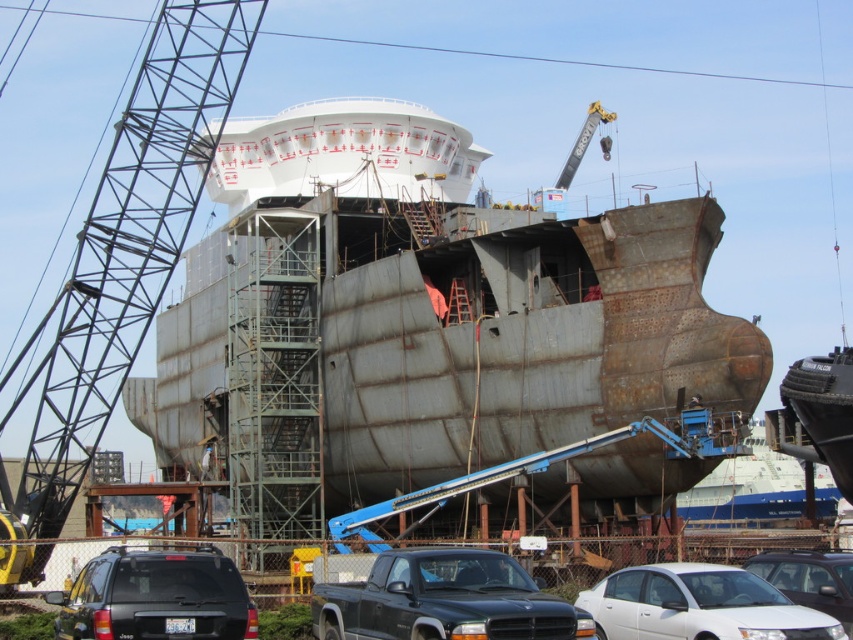
You are a delivery person who needs to park your van between the black matte suv at lower left and the white matte sedan at lower center in the shipyard. Your van is 6 meters long. Can you fit your van between them without overlapping either vehicle?

The distance between the black matte suv at lower left and the white matte sedan at lower center is 31.78 meters. Since your van is only 6 meters long, there is sufficient space to park it between them without overlapping either vehicle.

You are a delivery driver who needs to park your vehicle in the shipyard. You see the metallic black truck at center and the rusty metal ship at lower right. Which vehicle should you avoid parking near to ensure safety?

You should avoid parking near the rusty metal ship at lower right because the metallic black truck at center is positioned on the left side of it, implying the ship might be unstable or under repair, posing a safety risk.